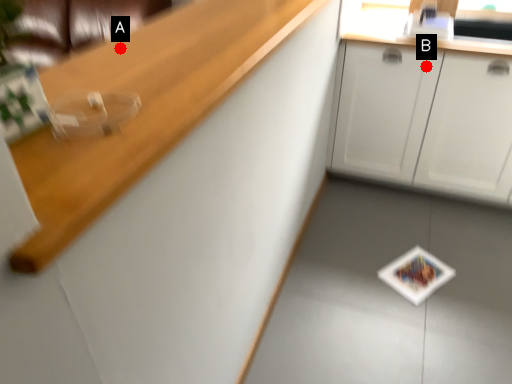
Question: Two points are circled on the image, labeled by A and B beside each circle. Which point is farther from the camera taking this photo?

Choices:
 (A) A is further
 (B) B is further

Answer: (B)